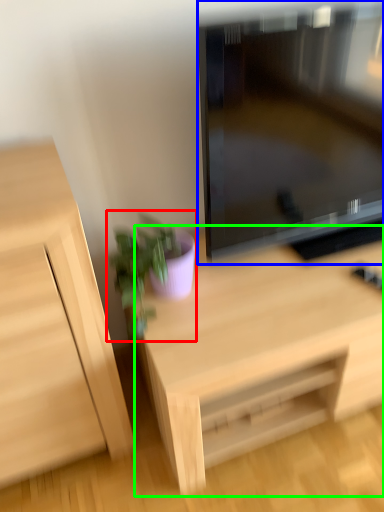
Question: Which is farther away from houseplant (highlighted by a red box)? television (highlighted by a blue box) or desk (highlighted by a green box)?

Choices:
 (A) television
 (B) desk

Answer: (A)